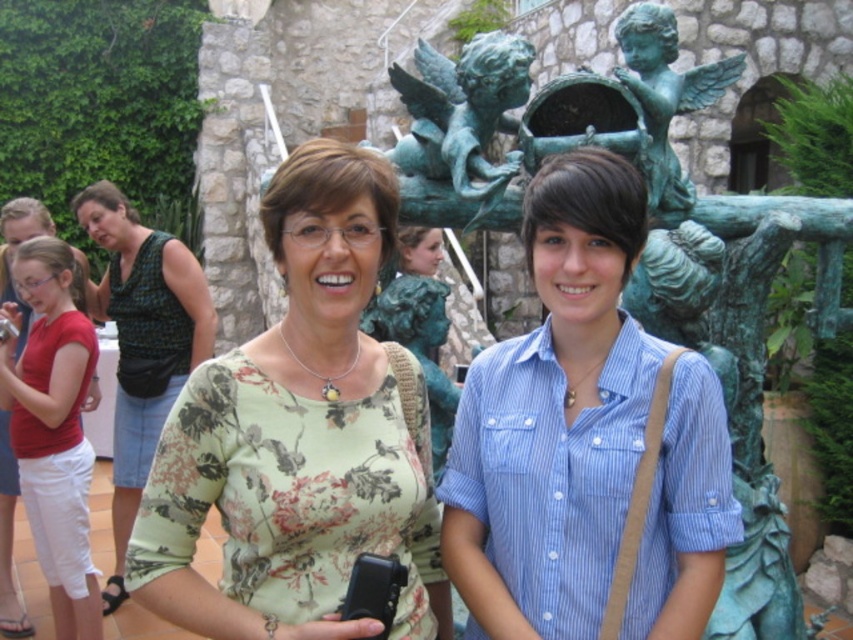
Question: Estimate the real-world distances between objects in this image. Which object is closer to the blue striped shirt at center?

Choices:
 (A) floral print blouse at center
 (B) green printed dress at left

Answer: (A)

Question: Where is blue striped shirt at center located in relation to matte red shirt at left in the image?

Choices:
 (A) left
 (B) right

Answer: (B)

Question: Can you confirm if floral print blouse at center is positioned above green printed dress at left?

Choices:
 (A) yes
 (B) no

Answer: (B)

Question: Can you confirm if blue striped shirt at center is smaller than matte red shirt at left?

Choices:
 (A) yes
 (B) no

Answer: (A)

Question: Which of the following is the farthest from the observer?

Choices:
 (A) blue striped shirt at center
 (B) floral print blouse at center
 (C) matte red shirt at left
 (D) green printed dress at left

Answer: (D)

Question: Which of the following is the closest to the observer?

Choices:
 (A) matte red shirt at left
 (B) floral print blouse at center
 (C) blue striped shirt at center
 (D) green printed dress at left

Answer: (B)